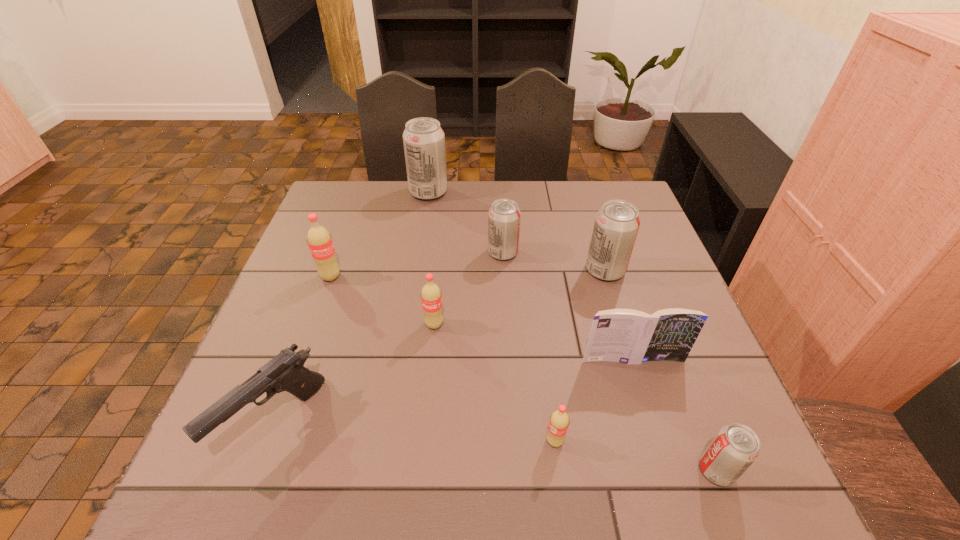
This screenshot has width=960, height=540. Identify the location of book. (629, 336).

Where is `gun`? Image resolution: width=960 pixels, height=540 pixels. gun is located at coordinates (285, 372).

Image resolution: width=960 pixels, height=540 pixels. What are the coordinates of `the rightmost red soda` in the screenshot? It's located at (559, 421).

Where is `the sixth farthest soda can`? This screenshot has height=540, width=960. the sixth farthest soda can is located at coordinates (559, 421).

The height and width of the screenshot is (540, 960). Identify the location of the smallest gray soda can. (735, 447).

Identify the location of the nearest gray soda can. Image resolution: width=960 pixels, height=540 pixels. (735, 447).

Find the location of `vacant space located 0.120m on the left of the tallest object`. vacant space located 0.120m on the left of the tallest object is located at coordinates (372, 192).

Identify the location of free spot located on the right of the leftmost red soda. (487, 276).

This screenshot has width=960, height=540. I want to click on free space located on the front of the sixth soda can from left to right, so click(630, 350).

The image size is (960, 540). Find the location of `vacant space situated on the left of the third gray soda can from right to left`. vacant space situated on the left of the third gray soda can from right to left is located at coordinates pos(412,253).